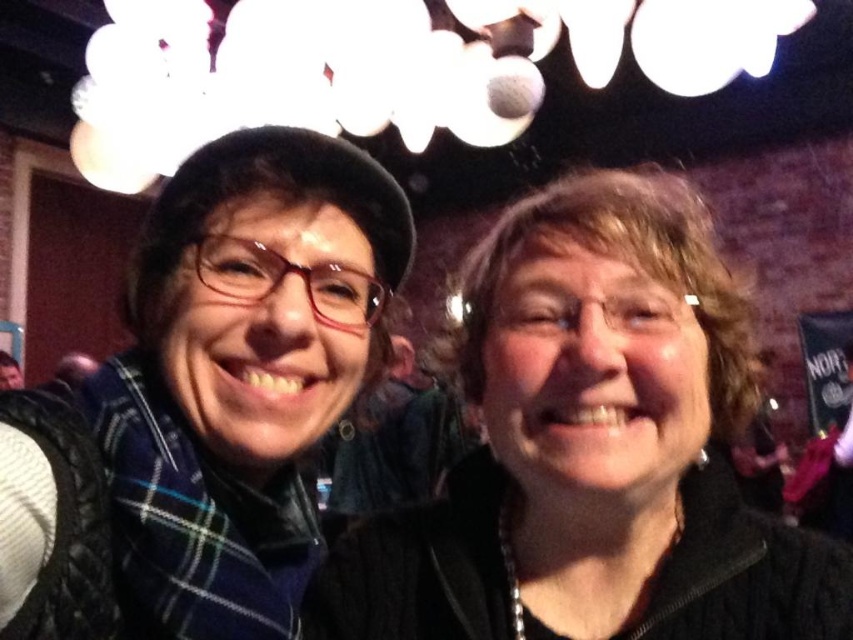
You are taking a photo of two people in a bar. The first person is at point (x=666, y=262) and the second person is at point (x=134, y=472). Which person is closer to the camera?

The person at point (x=666, y=262) is closer to the camera than the person at point (x=134, y=472).

You are a photographer setting up a shot in a dimly lit bar. You notice the black matte jacket at center and the plaid scarf at left. Which object should you focus on first if you want to capture the smaller one in detail?

The black matte jacket at center is smaller than the plaid scarf at left, so you should focus on the black matte jacket at center first to capture the smaller one in detail.